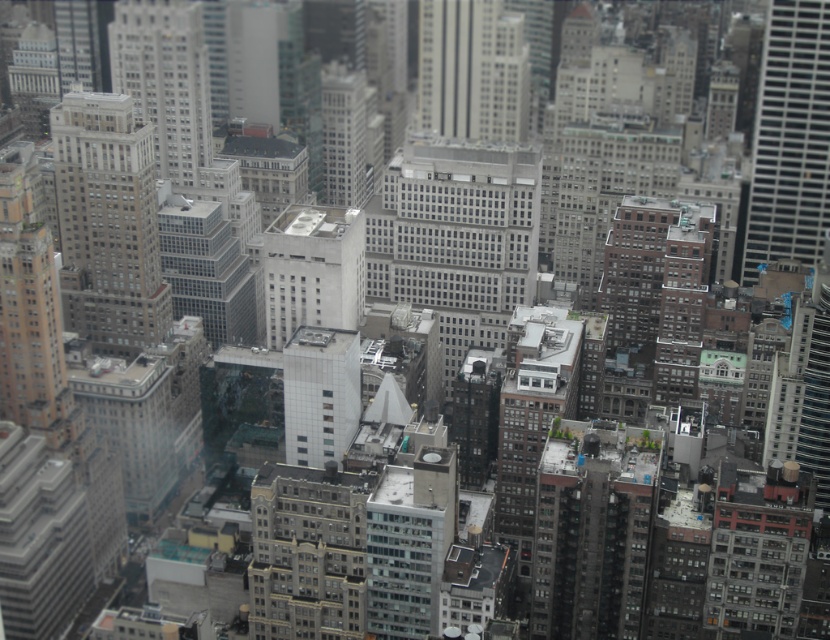
Question: Which point is farther to the camera?

Choices:
 (A) (433, 97)
 (B) (111, 54)

Answer: (B)

Question: Is gray concrete skyscraper at right to the left of white tile building at center from the viewer's perspective?

Choices:
 (A) no
 (B) yes

Answer: (A)

Question: Can you confirm if gray concrete building at center is thinner than matte gray building at left?

Choices:
 (A) no
 (B) yes

Answer: (A)

Question: Which object appears closest to the camera in this image?

Choices:
 (A) matte gray building at left
 (B) white smooth building at center

Answer: (B)

Question: Which is farther from the smooth gray skyscraper at center?

Choices:
 (A) white smooth building at center
 (B) gray concrete building at center
 (C) gray concrete skyscraper at upper center

Answer: (C)

Question: Does gray concrete skyscraper at right appear on the left side of white tile building at center?

Choices:
 (A) yes
 (B) no

Answer: (B)